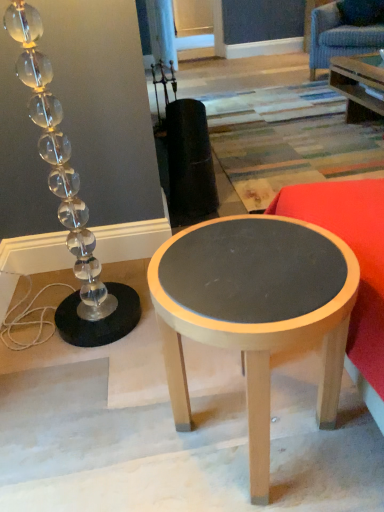
This screenshot has height=512, width=384. I want to click on vacant position to the left of matte gray wood table at center, so click(x=107, y=428).